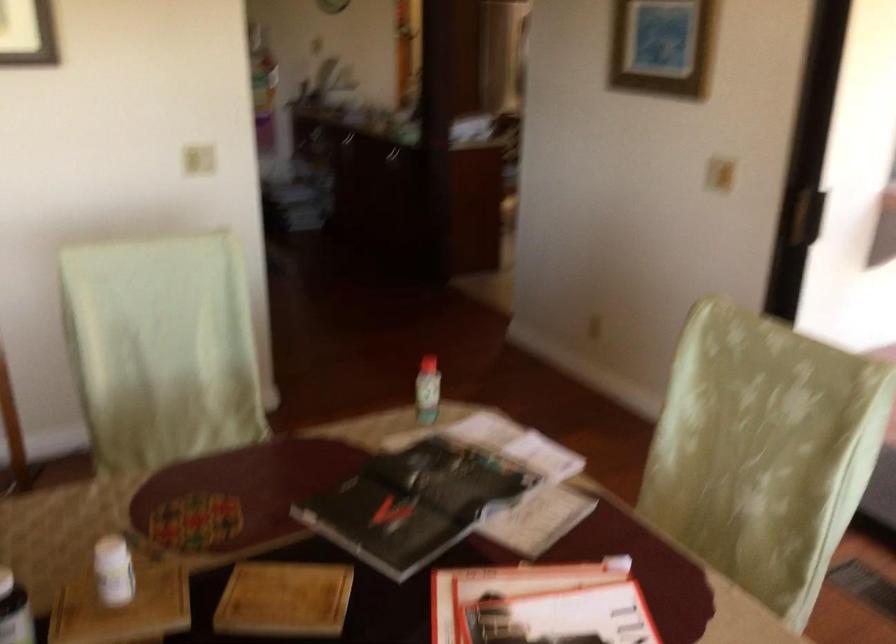
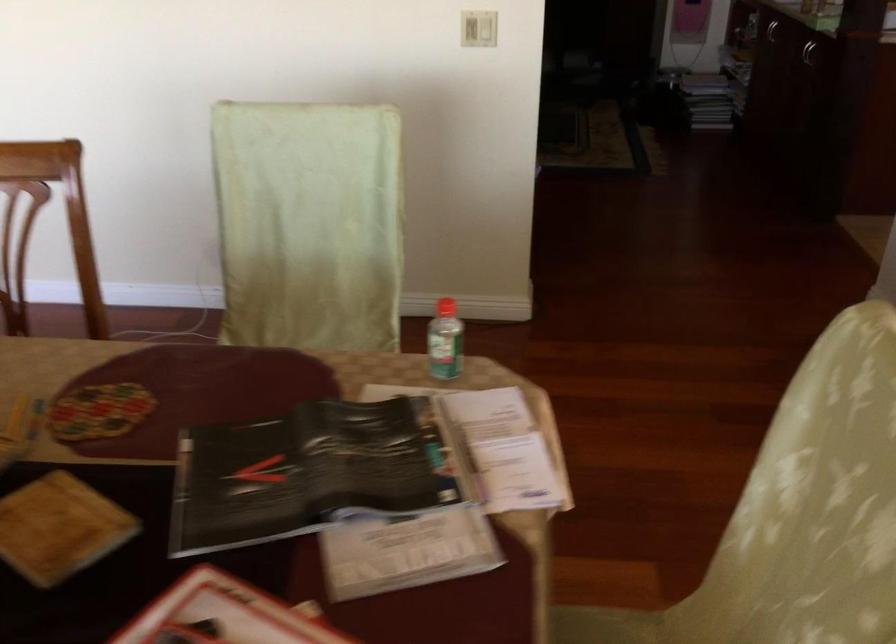
Where in the second image is the point corresponding to (433,392) from the first image?

(444, 341)